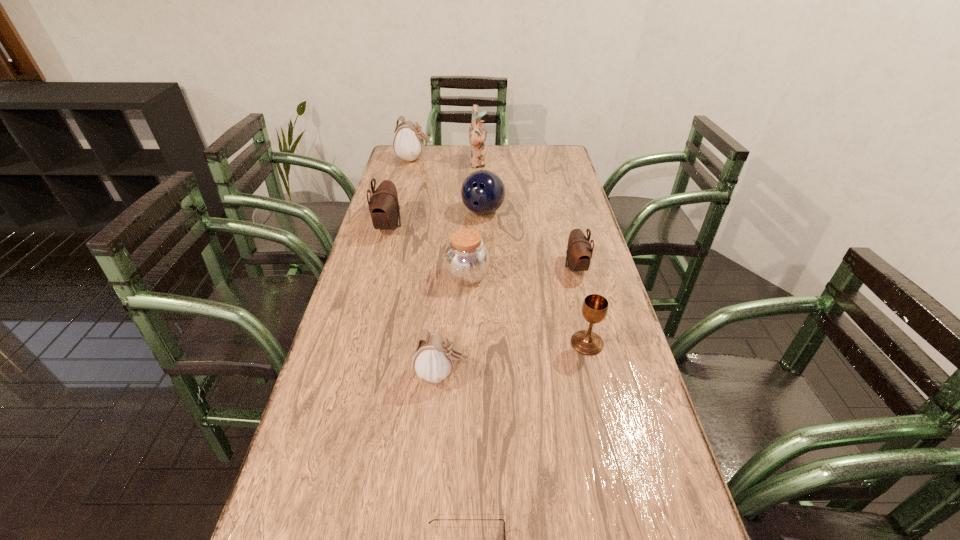
Where is `unoccupied area between the bowling ball and the second nearest object`? The width and height of the screenshot is (960, 540). unoccupied area between the bowling ball and the second nearest object is located at coordinates (462, 293).

At what (x,y) coordinates should I click in order to perform the action: click on object that is the fourth nearest to the brown jar. Please return your answer as a coordinate pair (x, y). Looking at the image, I should click on (434, 356).

Identify which object is the fourth nearest to the bowling ball. Please provide its 2D coordinates. Your answer should be formatted as a tuple, i.e. [(x, y)], where the tuple contains the x and y coordinates of a point satisfying the conditions above.

[(579, 251)]

This screenshot has width=960, height=540. I want to click on pouch that stands as the closest to the nearest object, so click(x=434, y=356).

This screenshot has width=960, height=540. In order to click on pouch that can be found as the third closest to the bigger white pouch in this screenshot , I will do `click(434, 356)`.

This screenshot has width=960, height=540. Find the location of `vacant space that satisfies the following two spatial constraints: 1. on the surface of the blue bowling ball near the finger holes; 2. with the flap open on the farther brown pouch`. vacant space that satisfies the following two spatial constraints: 1. on the surface of the blue bowling ball near the finger holes; 2. with the flap open on the farther brown pouch is located at coordinates (483, 226).

Where is `free region that satisfies the following two spatial constraints: 1. on the surface of the bowling ball near the finger holes; 2. on the front-facing side of the third pouch from left to right`? free region that satisfies the following two spatial constraints: 1. on the surface of the bowling ball near the finger holes; 2. on the front-facing side of the third pouch from left to right is located at coordinates click(485, 374).